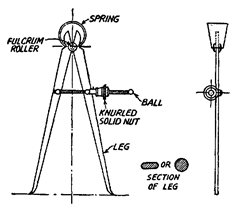
Identify the location of rod. This screenshot has width=240, height=206. (217, 179).